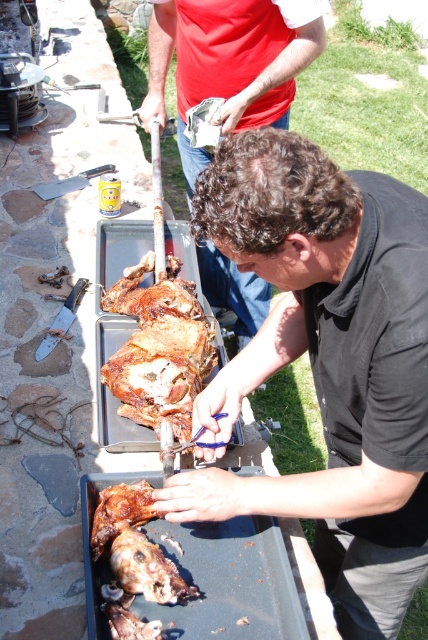
Question: Which object is positioned closest to the matte brown meat at center?

Choices:
 (A) black matte/softperson at center
 (B) brown crispy skin at center

Answer: (B)

Question: Observing the image, what is the correct spatial positioning of black matte/softperson at center in reference to matte brown meat at center?

Choices:
 (A) right
 (B) left

Answer: (A)

Question: Is black matte/softperson at center closer to camera compared to brown crispy skin at center?

Choices:
 (A) yes
 (B) no

Answer: (A)

Question: Which of these objects is positioned closest to the brown crispy skin at center?

Choices:
 (A) matte brown meat at center
 (B) black matte/softperson at center

Answer: (B)

Question: Which object appears farthest from the camera in this image?

Choices:
 (A) matte brown meat at center
 (B) black matte/softperson at center
 (C) brown crispy skin at center

Answer: (A)

Question: Considering the relative positions of black matte/softperson at center and matte brown meat at center in the image provided, where is black matte/softperson at center located with respect to matte brown meat at center?

Choices:
 (A) below
 (B) above

Answer: (A)